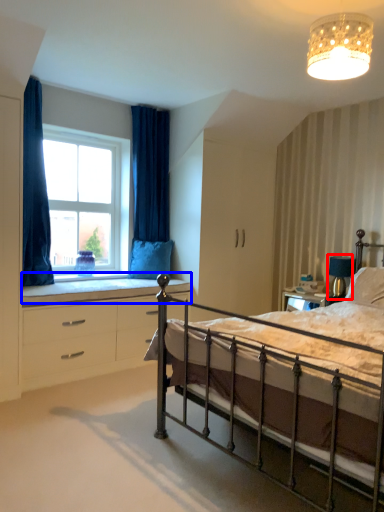
Question: Among these objects, which one is nearest to the camera, table lamp (highlighted by a red box) or window sill (highlighted by a blue box)?

Choices:
 (A) table lamp
 (B) window sill

Answer: (B)